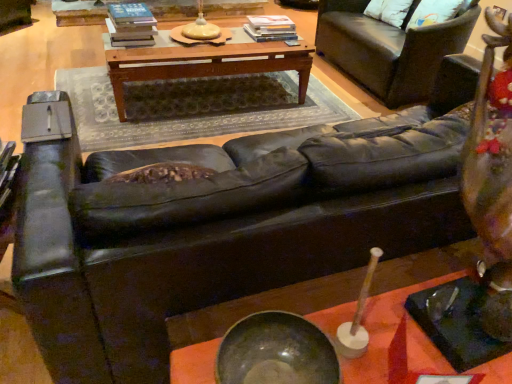
Locate an element on the screen. The width and height of the screenshot is (512, 384). vacant space situated above dark brown leather mat at center (from a real-world perspective) is located at coordinates (213, 109).